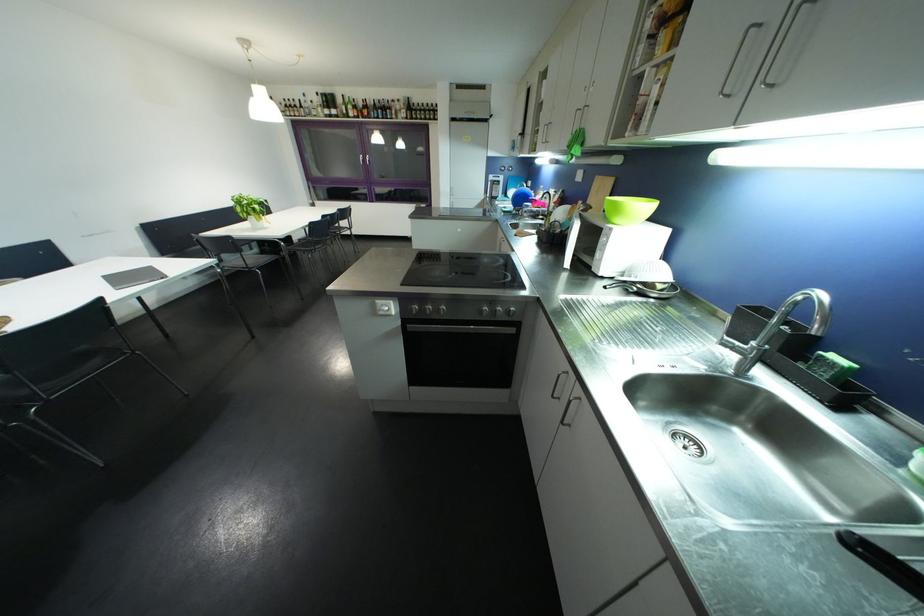
Find the location of a particular element. white plant pot is located at coordinates (251, 209).